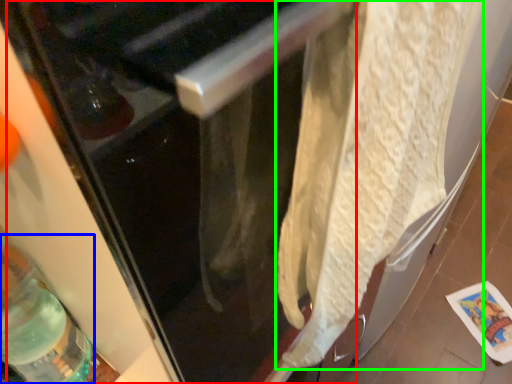
Question: Based on their relative distances, which object is nearer to screen door (highlighted by a red box)? Choose from bottle (highlighted by a blue box) and wrap (highlighted by a green box).

Choices:
 (A) bottle
 (B) wrap

Answer: (B)